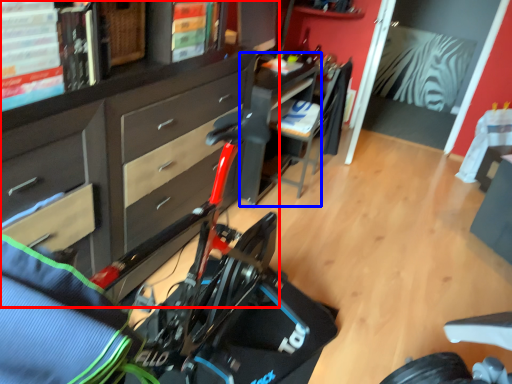
Question: Which of the following is the farthest to the observer, cabinetry (highlighted by a red box) or table (highlighted by a blue box)?

Choices:
 (A) cabinetry
 (B) table

Answer: (B)